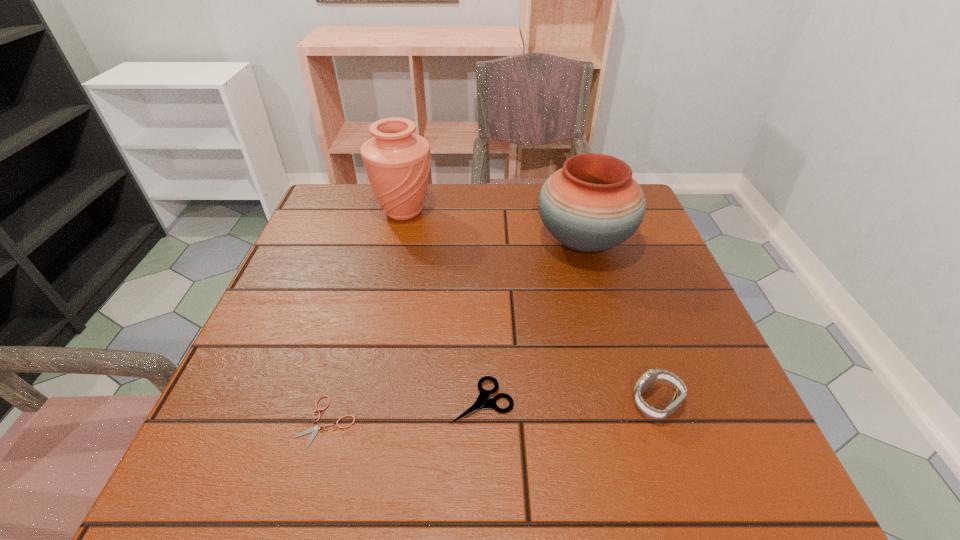
At what (x,y) coordinates should I click in order to perform the action: click on vacant space located 0.170m on the face of the third shortest object. Please return your answer as a coordinate pair (x, y). This screenshot has height=540, width=960. Looking at the image, I should click on (534, 402).

Locate an element on the screen. This screenshot has height=540, width=960. vacant area located on the face of the third shortest object is located at coordinates (420, 402).

Locate an element on the screen. This screenshot has width=960, height=540. free spot located 0.090m on the front of the third object from right to left is located at coordinates click(483, 481).

The image size is (960, 540). In order to click on free space located on the left of the shortest object in this screenshot , I will do `click(263, 421)`.

Where is `vase that is at the far edge`? vase that is at the far edge is located at coordinates click(x=397, y=162).

Find the location of a particular element. The height and width of the screenshot is (540, 960). pottery that is at the far edge is located at coordinates (592, 204).

This screenshot has width=960, height=540. I want to click on object present at the near edge, so click(x=315, y=428).

The height and width of the screenshot is (540, 960). I want to click on vase situated at the left edge, so click(x=397, y=162).

Locate an element on the screen. shears at the left edge is located at coordinates (315, 428).

Identify the location of pottery present at the right edge. (592, 204).